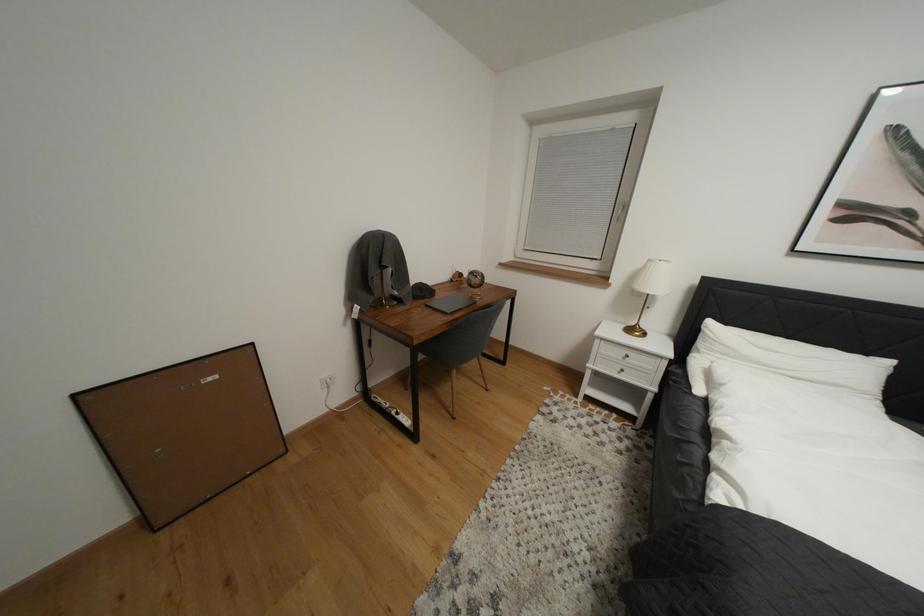
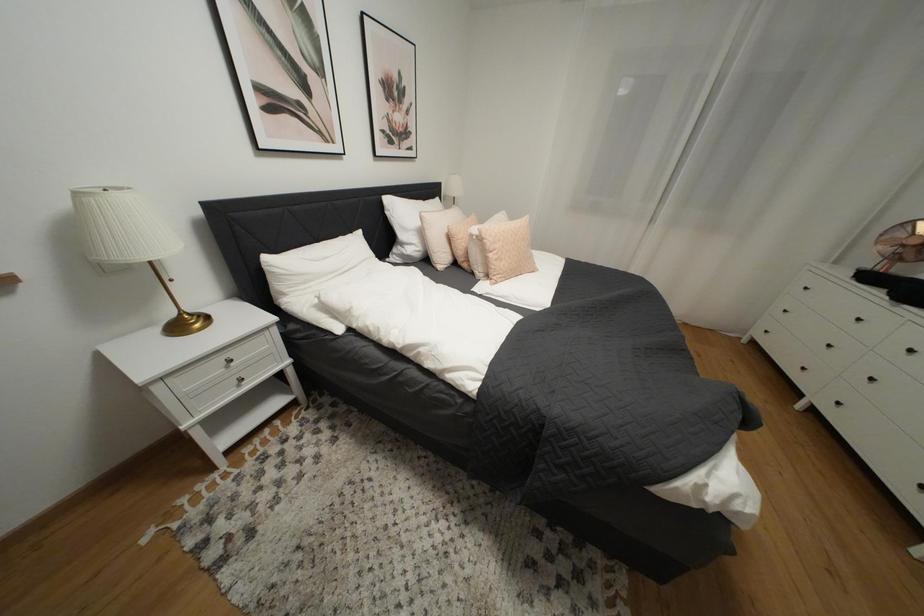
How did the camera likely rotate?

The rotation direction of the camera is right-down.